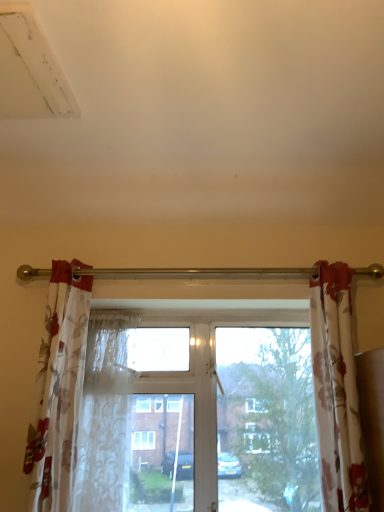
Question: Considering the relative sizes of translucent floral fabric at center and floral sheer curtain at left, marked as the first curtain in a left-to-right arrangement, in the image provided, is translucent floral fabric at center smaller than floral sheer curtain at left, marked as the first curtain in a left-to-right arrangement,?

Choices:
 (A) no
 (B) yes

Answer: (B)

Question: Is translucent floral fabric at center facing towards floral sheer curtain at left, the second curtain in the right-to-left sequence?

Choices:
 (A) no
 (B) yes

Answer: (B)

Question: Is translucent floral fabric at center behind floral sheer curtain at left, the second curtain in the right-to-left sequence?

Choices:
 (A) no
 (B) yes

Answer: (B)

Question: Considering the relative positions of translucent floral fabric at center and floral sheer curtain at left, the second curtain in the right-to-left sequence, in the image provided, is translucent floral fabric at center in front of floral sheer curtain at left, the second curtain in the right-to-left sequence,?

Choices:
 (A) no
 (B) yes

Answer: (A)

Question: Considering the relative sizes of translucent floral fabric at center and floral sheer curtain at left, the second curtain in the right-to-left sequence, in the image provided, is translucent floral fabric at center shorter than floral sheer curtain at left, the second curtain in the right-to-left sequence,?

Choices:
 (A) yes
 (B) no

Answer: (A)

Question: From a real-world perspective, is translucent floral fabric at center over floral sheer curtain at left, the second curtain in the right-to-left sequence?

Choices:
 (A) no
 (B) yes

Answer: (A)

Question: Is floral sheer curtain at left, the second curtain in the right-to-left sequence, aimed at translucent floral fabric at center?

Choices:
 (A) no
 (B) yes

Answer: (A)

Question: Is floral sheer curtain at left, marked as the first curtain in a left-to-right arrangement, smaller than translucent floral fabric at center?

Choices:
 (A) yes
 (B) no

Answer: (B)

Question: Considering the relative sizes of floral sheer curtain at left, the second curtain in the right-to-left sequence, and translucent floral fabric at center in the image provided, is floral sheer curtain at left, the second curtain in the right-to-left sequence, shorter than translucent floral fabric at center?

Choices:
 (A) no
 (B) yes

Answer: (A)

Question: Can you see floral sheer curtain at left, the second curtain in the right-to-left sequence, touching translucent floral fabric at center?

Choices:
 (A) yes
 (B) no

Answer: (B)

Question: From the image's perspective, does floral sheer curtain at left, the second curtain in the right-to-left sequence, appear higher than translucent floral fabric at center?

Choices:
 (A) no
 (B) yes

Answer: (B)

Question: Is floral sheer curtain at left, the second curtain in the right-to-left sequence, thinner than translucent floral fabric at center?

Choices:
 (A) yes
 (B) no

Answer: (B)

Question: Considering the relative sizes of floral sheer curtain at left, marked as the first curtain in a left-to-right arrangement, and floral fabric curtain at right, which is the 1th curtain in right-to-left order, in the image provided, is floral sheer curtain at left, marked as the first curtain in a left-to-right arrangement, wider than floral fabric curtain at right, which is the 1th curtain in right-to-left order,?

Choices:
 (A) yes
 (B) no

Answer: (A)